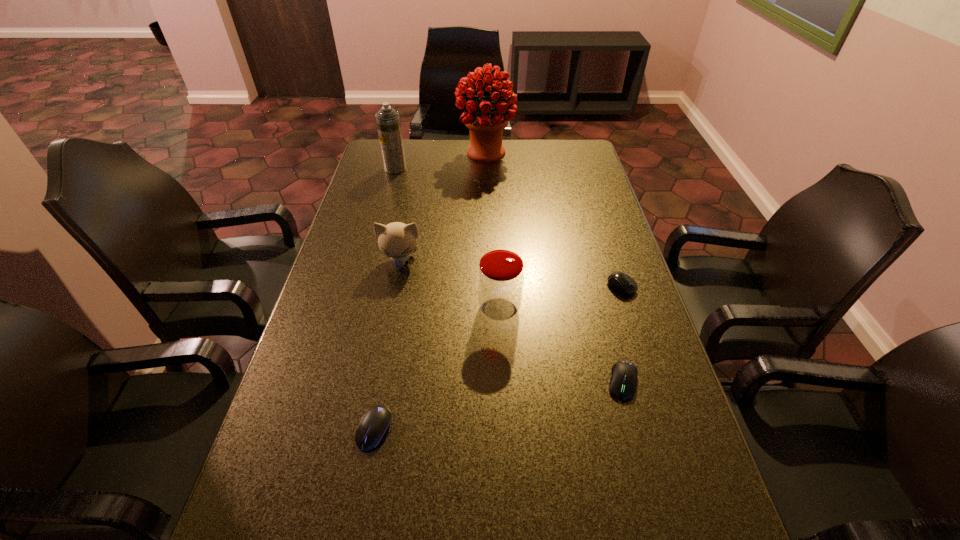
You are a GUI agent. You are given a task and a screenshot of the screen. Output one action in this format:
    pyautogui.click(x=<x>, y=<y>)
    Task: Click on the free space between the farthest computer mouse and the sixth farthest object
    
    Given the screenshot: What is the action you would take?
    pyautogui.click(x=622, y=334)

The width and height of the screenshot is (960, 540). I want to click on vacant space that is in between the nearest object and the third tallest object, so click(437, 369).

This screenshot has height=540, width=960. What are the coordinates of `object that ranks as the fifth closest to the bouquet` in the screenshot? It's located at coord(623,382).

In order to click on object that can be found as the sixth closest to the aerosol can in this screenshot , I will do `click(623, 382)`.

Image resolution: width=960 pixels, height=540 pixels. I want to click on the second closest computer mouse to the nearest computer mouse, so click(621, 282).

Identify the location of computer mouse that can be found as the closest to the second nearest object. This screenshot has width=960, height=540. (621, 282).

I want to click on free spot that satisfies the following two spatial constraints: 1. on the back side of the nearest computer mouse; 2. on the left side of the fifth shortest object, so click(396, 309).

Where is `vacant position in the image that satisfies the following two spatial constraints: 1. on the face of the fifth nearest object; 2. on the left side of the second farthest computer mouse`? The width and height of the screenshot is (960, 540). vacant position in the image that satisfies the following two spatial constraints: 1. on the face of the fifth nearest object; 2. on the left side of the second farthest computer mouse is located at coordinates (377, 381).

Image resolution: width=960 pixels, height=540 pixels. Identify the location of vacant space that satisfies the following two spatial constraints: 1. on the face of the third tallest object; 2. on the right side of the kitten. (392, 309).

Identify the location of free point that satisfies the following two spatial constraints: 1. on the face of the kitten; 2. on the right side of the nearest object. (368, 430).